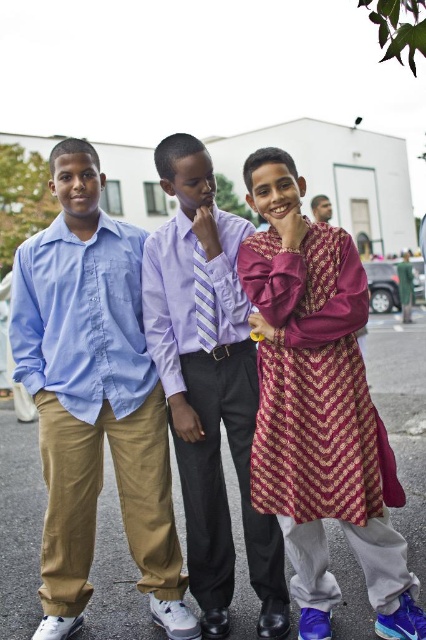
You are a photographer setting up a photo shoot in a parking lot. You notice two items at the center of your viewfinder, the purple striped tie at center and the gold textured fabric at center. Which item appears taller in the frame?

The gold textured fabric at center appears taller than the purple striped tie at center.

You are a photographer setting up a shoot in the parking lot. You notice two details in the middle of the image that need to be adjusted before taking the photo. The first is the purple striped tie at center, and the second is the gold textured fabric at center. According to the scene, which of these two items is positioned to the left?

The purple striped tie at center is to the left of the gold textured fabric at center, so the purple striped tie at center is positioned to the left.

You are a photographer trying to capture a group photo of the boys. Since the light blue cotton shirt at center and the purple striped tie at center are overlapping, which one should you adjust to ensure both are fully visible?

The light blue cotton shirt at center is in front of the purple striped tie at center. To ensure both are fully visible, you should adjust the light blue cotton shirt at center to move it slightly backward or to the side so the purple striped tie at center can be seen clearly.